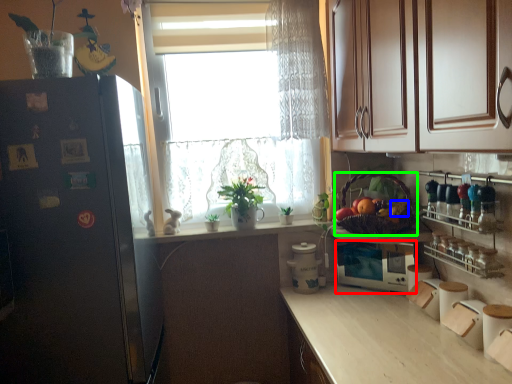
Question: Based on their relative distances, which object is farther from appliance (highlighted by a red box)? Choose from fruit (highlighted by a blue box) and basket (highlighted by a green box).

Choices:
 (A) fruit
 (B) basket

Answer: (A)